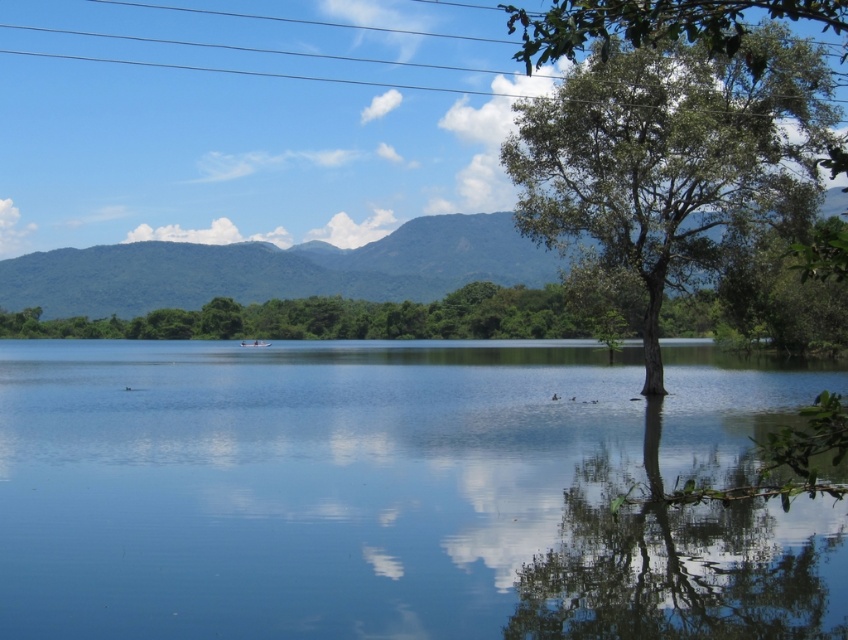
Does transparent water at center appear over green leafy mountain at center?

Actually, transparent water at center is below green leafy mountain at center.

Can you confirm if transparent water at center is smaller than green leafy mountain at center?

Correct, transparent water at center occupies less space than green leafy mountain at center.

At what (x,y) coordinates should I click in order to perform the action: click on transparent water at center. Please return your answer as a coordinate pair (x, y). Image resolution: width=848 pixels, height=640 pixels. Looking at the image, I should click on (399, 492).

Does transparent water at center appear on the right side of green leafy tree at right?

Incorrect, transparent water at center is not on the right side of green leafy tree at right.

Can you confirm if transparent water at center is smaller than green leafy tree at right?

Indeed, transparent water at center has a smaller size compared to green leafy tree at right.

Is point (752, 403) positioned behind point (682, 237)?

Yes.

In order to click on transparent water at center in this screenshot , I will do `click(399, 492)`.

Is point (629, 216) farther from camera compared to point (93, 259)?

No, (629, 216) is closer to viewer.

Who is more forward, (x=810, y=152) or (x=25, y=292)?

Point (x=810, y=152) is more forward.

Where is `green leafy tree at right`? green leafy tree at right is located at coordinates (667, 129).